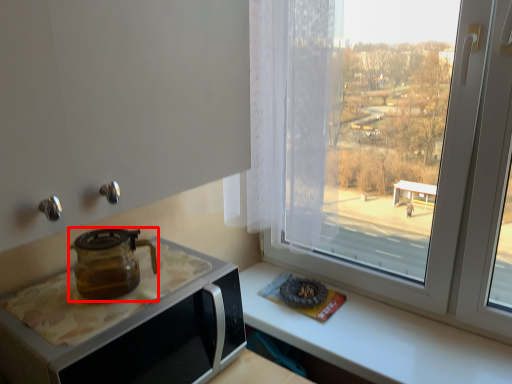
Question: From the image, what is the correct spatial relationship of kitchen appliance (annotated by the red box) in relation to appliance?

Choices:
 (A) left
 (B) right

Answer: (A)